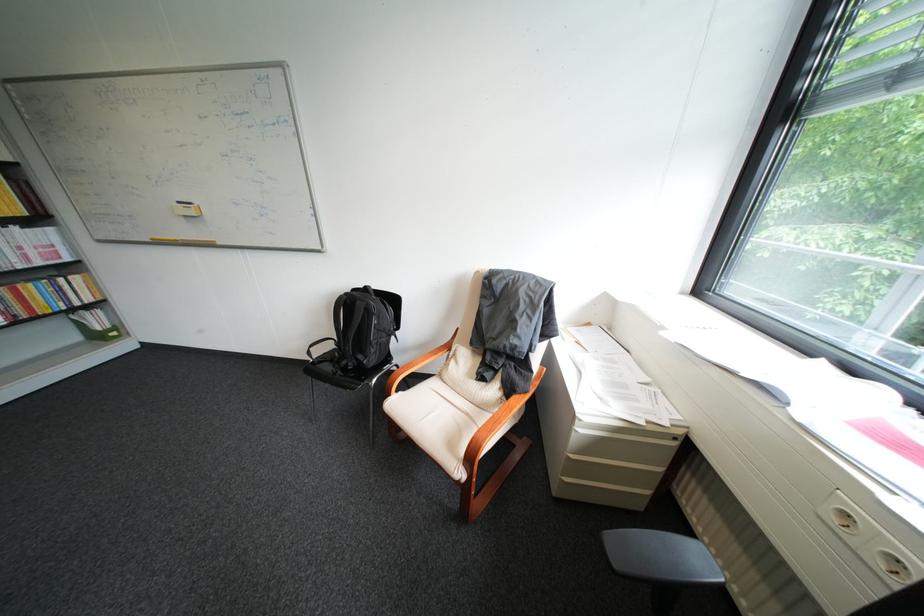
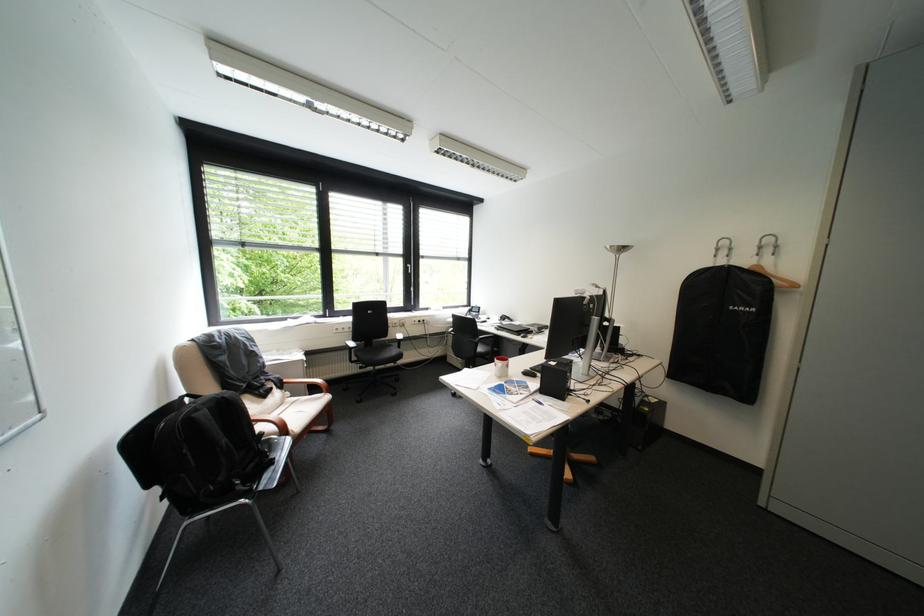
Where in the second image is the point corresponding to [480,376] from the first image?

(272, 403)